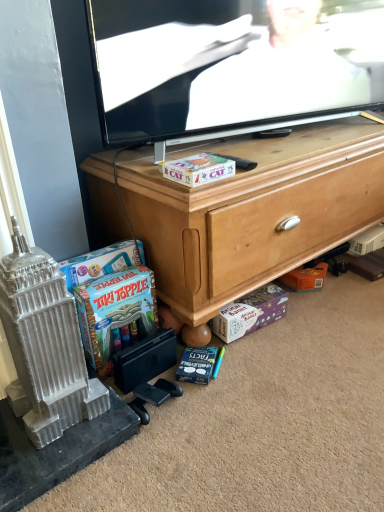
Locate an element on the screen. This screenshot has width=384, height=512. vacant area located to the right-hand side of purple cardboard box at lower center, which is the 1th cash from right to left is located at coordinates (302, 327).